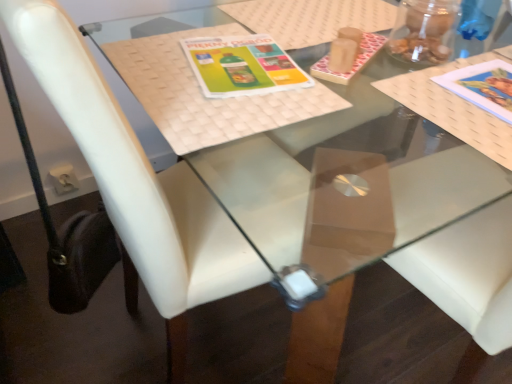
The height and width of the screenshot is (384, 512). Find the location of `vacant area in front of matte green plastic book cover at center, placed as the 2th book cover when sorted from right to left`. vacant area in front of matte green plastic book cover at center, placed as the 2th book cover when sorted from right to left is located at coordinates (231, 114).